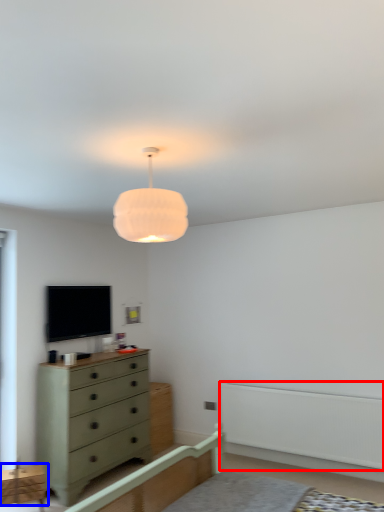
Question: Which object appears farthest to the camera in this image, balustrade (highlighted by a red box) or cabinetry (highlighted by a blue box)?

Choices:
 (A) balustrade
 (B) cabinetry

Answer: (A)